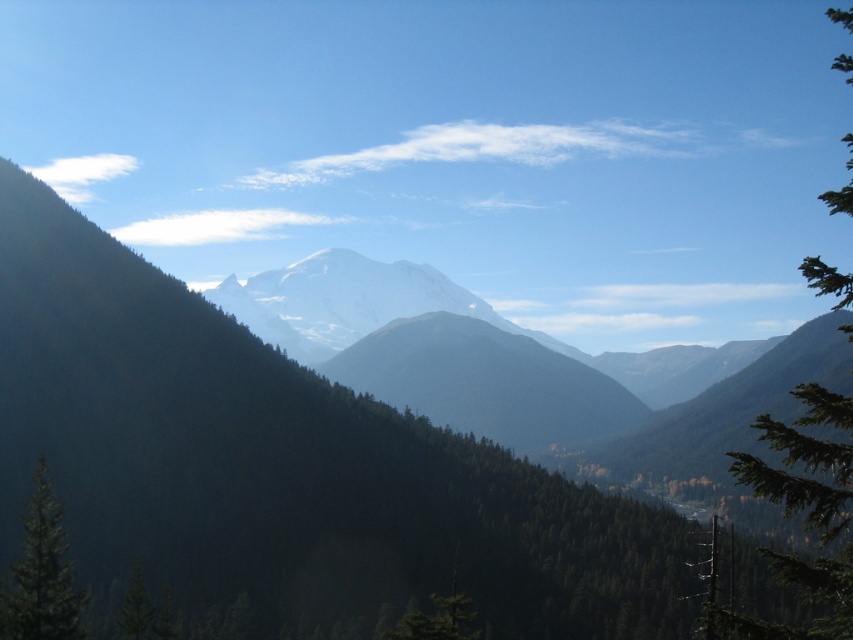
You are standing in the mountainous landscape and see a point marked at coordinates [805,509]. Which object does this point belong to?

The point at coordinates [805,509] is on the green textured tree at right.

You are an environmental scientist studying tree growth patterns in mountainous regions. You observe two green textured trees in the scene. Which tree, the green textured tree at right or the green textured tree at lower left, is larger in size?

The green textured tree at right is bigger than the green textured tree at lower left according to the description.

You are a hiker planning to walk from the green textured tree at lower left to the green textured tree at right. Given that your average walking pace is 1.4 meters per second, how many minutes will it take you to reach the destination?

The distance between the green textured tree at right and the green textured tree at lower left is 183.44 meters. At a pace of 1.4 meters per second, it would take approximately 131 seconds, which is about 2.18 minutes. Therefore, it will take roughly 2 minutes and 11 seconds to reach the destination.